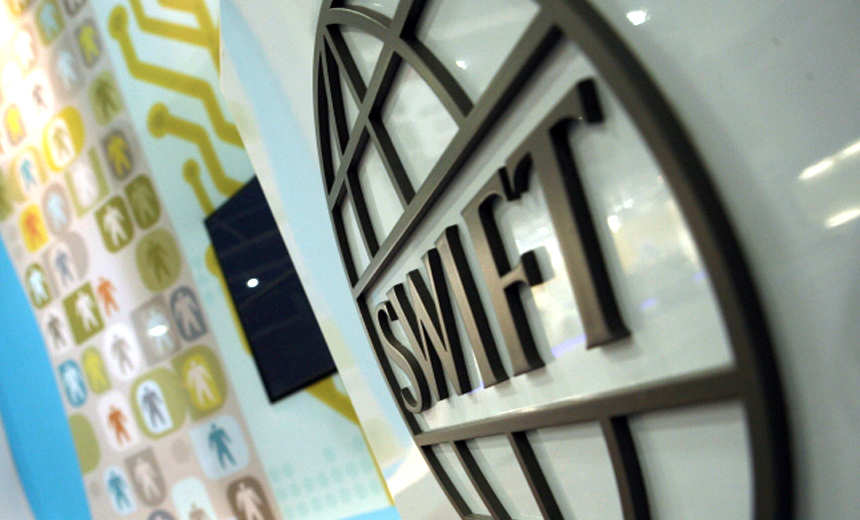
Find the location of a particular element. Image resolution: width=860 pixels, height=520 pixels. shiny gray wall is located at coordinates (765, 212).